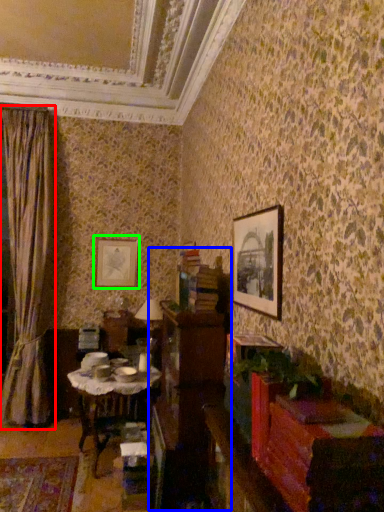
Question: Which object is positioned farthest from curtain (highlighted by a red box)? Select from dresser (highlighted by a blue box) and picture frame (highlighted by a green box).

Choices:
 (A) dresser
 (B) picture frame

Answer: (A)